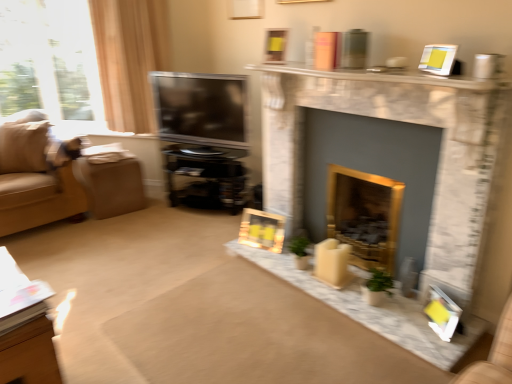
Question: Which direction should I rotate to look at black glossy entertainment center at center?

Choices:
 (A) left
 (B) right

Answer: (A)

Question: From a real-world perspective, is wooden table at lower left under marble fireplace at center, which appears as the 2th fireplace when viewed from the back?

Choices:
 (A) yes
 (B) no

Answer: (A)

Question: Is wooden table at lower left next to marble fireplace at center, which appears as the 2th fireplace when viewed from the back, and touching it?

Choices:
 (A) yes
 (B) no

Answer: (B)

Question: From the image's perspective, is wooden table at lower left located above marble fireplace at center, the 1th fireplace in the front-to-back sequence?

Choices:
 (A) yes
 (B) no

Answer: (B)

Question: Is wooden table at lower left turned away from marble fireplace at center, which appears as the 2th fireplace when viewed from the back?

Choices:
 (A) yes
 (B) no

Answer: (B)

Question: Is wooden table at lower left not near marble fireplace at center, the 1th fireplace in the front-to-back sequence?

Choices:
 (A) no
 (B) yes

Answer: (B)

Question: Is wooden table at lower left located outside marble fireplace at center, the 1th fireplace in the front-to-back sequence?

Choices:
 (A) yes
 (B) no

Answer: (A)

Question: Is there a large distance between black glossy entertainment center at center and brown fabric footrest at left?

Choices:
 (A) no
 (B) yes

Answer: (A)

Question: Are black glossy entertainment center at center and brown fabric footrest at left making contact?

Choices:
 (A) yes
 (B) no

Answer: (B)

Question: Can we say black glossy entertainment center at center lies outside brown fabric footrest at left?

Choices:
 (A) yes
 (B) no

Answer: (A)

Question: Can you confirm if black glossy entertainment center at center is positioned to the right of brown fabric footrest at left?

Choices:
 (A) yes
 (B) no

Answer: (A)

Question: Is black glossy entertainment center at center further to the viewer compared to brown fabric footrest at left?

Choices:
 (A) no
 (B) yes

Answer: (A)

Question: Is black glossy entertainment center at center closer to camera compared to brown fabric footrest at left?

Choices:
 (A) no
 (B) yes

Answer: (B)

Question: From the image's perspective, is marble fireplace at center, which appears as the 2th fireplace when viewed from the back, over suede beige couch at left?

Choices:
 (A) no
 (B) yes

Answer: (A)